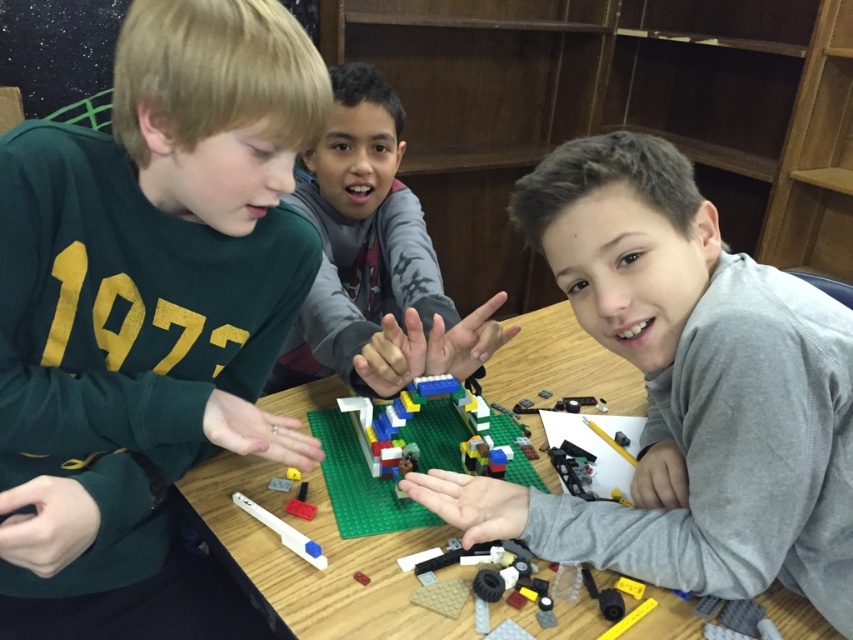
Can you confirm if gray matte shirt at center is thinner than matte gray sweater at center?

Incorrect, gray matte shirt at center's width is not less than matte gray sweater at center's.

Between gray matte shirt at center and matte gray sweater at center, which one is positioned higher?

matte gray sweater at center is above.

Between point (576, 289) and point (398, 205), which one is positioned behind?

The point (398, 205) is more distant.

The height and width of the screenshot is (640, 853). Find the location of `gray matte shirt at center`. gray matte shirt at center is located at coordinates (686, 392).

Who is lower down, green plastic table at center or multicolored plastic lego structure at center?

multicolored plastic lego structure at center is below.

Does point (329, 538) lie in front of point (337, 483)?

Yes, it is.

The height and width of the screenshot is (640, 853). Identify the location of green plastic table at center. (306, 563).

Is green plastic table at center below matte gray sweater at center?

Yes, green plastic table at center is below matte gray sweater at center.

Which is above, green plastic table at center or matte gray sweater at center?

matte gray sweater at center is above.

What do you see at coordinates (306, 563) in the screenshot? I see `green plastic table at center` at bounding box center [306, 563].

Locate an element on the screen. green plastic table at center is located at coordinates (306, 563).